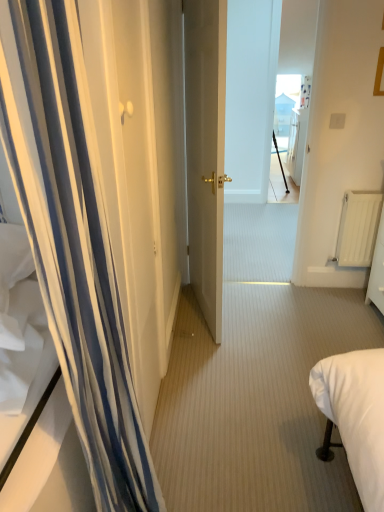
Question: Is matte gold door at center smaller than black matte tripod at center?

Choices:
 (A) yes
 (B) no

Answer: (B)

Question: Can you confirm if matte gold door at center is positioned to the right of black matte tripod at center?

Choices:
 (A) no
 (B) yes

Answer: (A)

Question: From a real-world perspective, does matte gold door at center stand above black matte tripod at center?

Choices:
 (A) no
 (B) yes

Answer: (B)

Question: Is matte gold door at center turned away from black matte tripod at center?

Choices:
 (A) no
 (B) yes

Answer: (A)

Question: Is matte gold door at center aimed at black matte tripod at center?

Choices:
 (A) yes
 (B) no

Answer: (B)

Question: Does point (359, 264) appear closer or farther from the camera than point (137, 441)?

Choices:
 (A) farther
 (B) closer

Answer: (A)

Question: In terms of width, does white matte radiator at right look wider or thinner when compared to white striped curtain at left?

Choices:
 (A) thin
 (B) wide

Answer: (A)

Question: In terms of size, does white matte radiator at right appear bigger or smaller than white striped curtain at left?

Choices:
 (A) small
 (B) big

Answer: (A)

Question: Based on their positions, is white matte radiator at right located to the left or right of white striped curtain at left?

Choices:
 (A) left
 (B) right

Answer: (B)

Question: Is black matte tripod at center in front of or behind white striped curtain at left in the image?

Choices:
 (A) front
 (B) behind

Answer: (B)

Question: Is black matte tripod at center taller or shorter than white striped curtain at left?

Choices:
 (A) short
 (B) tall

Answer: (A)

Question: Is black matte tripod at center inside the boundaries of white striped curtain at left, or outside?

Choices:
 (A) inside
 (B) outside

Answer: (B)

Question: From a real-world perspective, relative to white striped curtain at left, is black matte tripod at center vertically above or below?

Choices:
 (A) above
 (B) below

Answer: (B)

Question: From the image's perspective, is white matte radiator at right located above or below matte gold door at center?

Choices:
 (A) below
 (B) above

Answer: (A)

Question: Considering the relative positions of white matte radiator at right and matte gold door at center in the image provided, is white matte radiator at right to the left or to the right of matte gold door at center?

Choices:
 (A) right
 (B) left

Answer: (A)